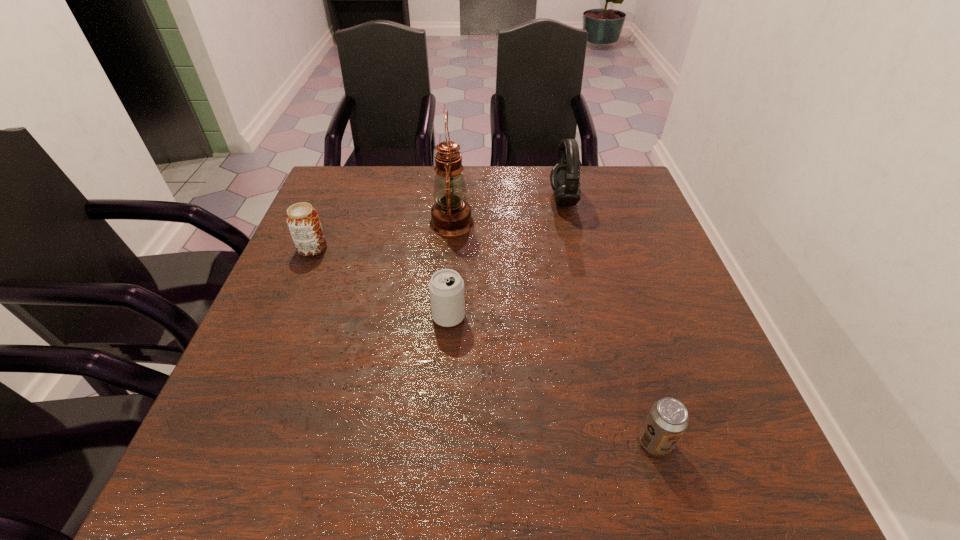
Find the location of `vacant area that lies between the nearer beer can and the leftmost object`. vacant area that lies between the nearer beer can and the leftmost object is located at coordinates (484, 345).

The width and height of the screenshot is (960, 540). I want to click on vacant space in between the second tallest object and the oil lamp, so click(507, 211).

Identify the location of vacant area between the headset and the nearest object. (609, 321).

Select which object appears as the third closest to the tallest object. Please provide its 2D coordinates. Your answer should be formatted as a tuple, i.e. [(x, y)], where the tuple contains the x and y coordinates of a point satisfying the conditions above.

[(302, 219)]

Identify which object is located as the nearest to the left beer can. Please provide its 2D coordinates. Your answer should be formatted as a tuple, i.e. [(x, y)], where the tuple contains the x and y coordinates of a point satisfying the conditions above.

[(451, 215)]

You are a GUI agent. You are given a task and a screenshot of the screen. Output one action in this format:
    pyautogui.click(x=<x>, y=<y>)
    Task: Click on the vacant region that satisfies the following two spatial constraints: 1. on the front side of the can; 2. on the left side of the tallest object
    Image resolution: width=960 pixels, height=540 pixels.
    Given the screenshot: What is the action you would take?
    pyautogui.click(x=444, y=316)

Identify the location of free space in the image that satisfies the following two spatial constraints: 1. on the front side of the nearer beer can; 2. on the left side of the farther beer can. (230, 442).

Find the location of a particular element. This screenshot has height=540, width=960. vacant region that satisfies the following two spatial constraints: 1. on the earcups of the fourth shortest object; 2. on the back side of the right beer can is located at coordinates (620, 442).